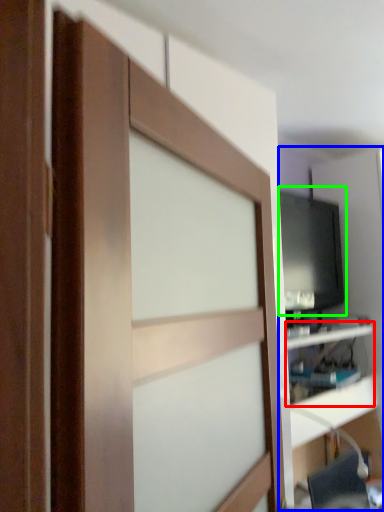
Question: Which object is positioned closest to shelf (highlighted by a red box)? Select from entertainment center (highlighted by a blue box) and computer monitor (highlighted by a green box).

Choices:
 (A) entertainment center
 (B) computer monitor

Answer: (B)